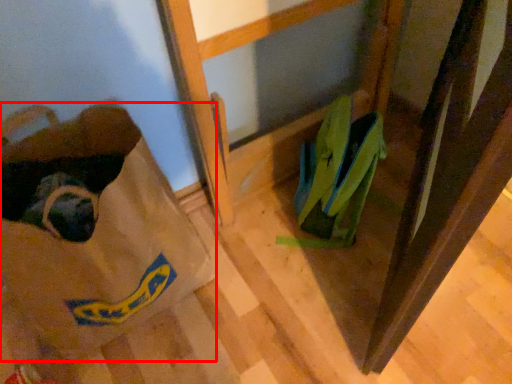
Question: From the image's perspective, considering the relative positions of grocery bag (annotated by the red box) and footwear in the image provided, where is grocery bag (annotated by the red box) located with respect to the staircase?

Choices:
 (A) above
 (B) below

Answer: (B)